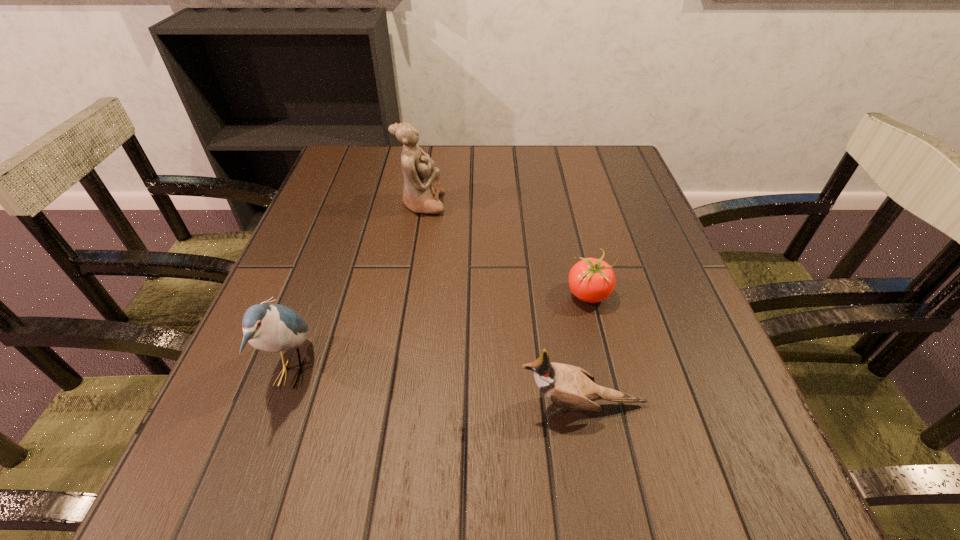
Find the location of `vacant space located 0.380m at the face of the shorter bird`. vacant space located 0.380m at the face of the shorter bird is located at coordinates (268, 405).

This screenshot has width=960, height=540. Identify the location of vacant region located at the face of the shorter bird. (432, 405).

Identify the location of free spot located at the face of the shorter bird. The image size is (960, 540). (268, 405).

The height and width of the screenshot is (540, 960). What are the coordinates of `vacant space located 0.300m on the back of the tomato` in the screenshot? It's located at (564, 194).

You are a GUI agent. You are given a task and a screenshot of the screen. Output one action in this format:
    pyautogui.click(x=<x>, y=<y>)
    Task: Click on the object positioned at the far edge
    The width and height of the screenshot is (960, 540).
    Given the screenshot: What is the action you would take?
    pyautogui.click(x=422, y=187)

Where is `object positioned at the left edge`? This screenshot has height=540, width=960. object positioned at the left edge is located at coordinates (271, 327).

The image size is (960, 540). What are the coordinates of `bird present at the right edge` in the screenshot? It's located at (567, 385).

Where is `tomato present at the right edge`? Image resolution: width=960 pixels, height=540 pixels. tomato present at the right edge is located at coordinates (591, 280).

The image size is (960, 540). I want to click on free space at the far edge, so click(x=485, y=179).

In the image, there is a desktop. In order to click on vacant space at the near edge in this screenshot , I will do `click(384, 488)`.